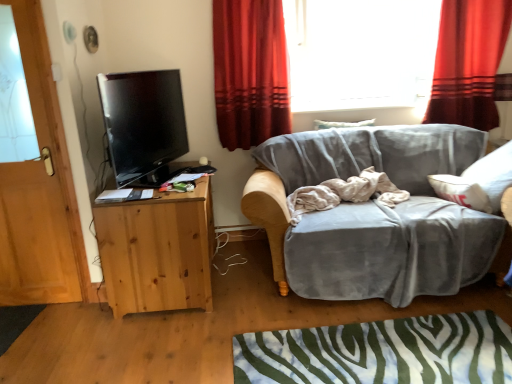
Image resolution: width=512 pixels, height=384 pixels. In order to click on free space in front of wooden door at left in this screenshot , I will do `click(32, 330)`.